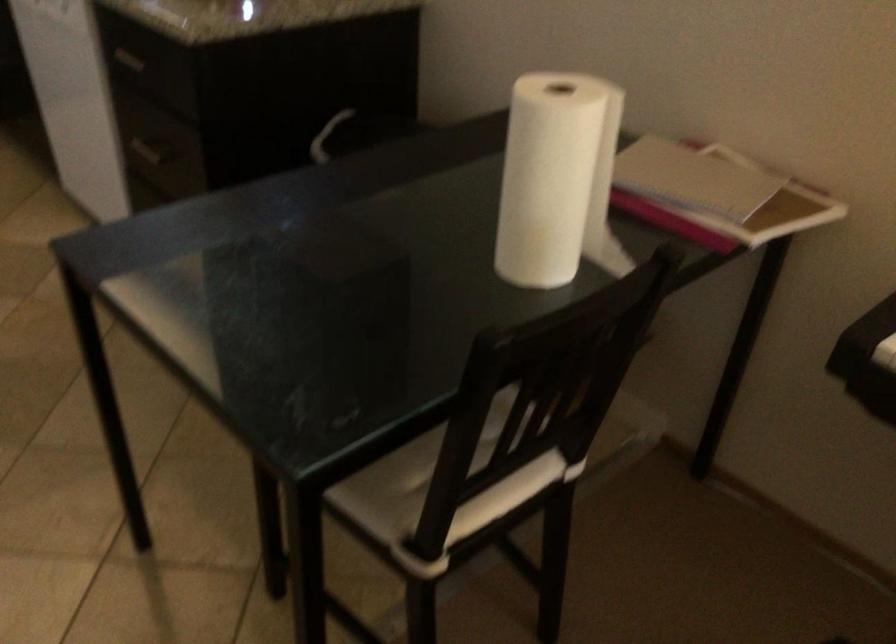
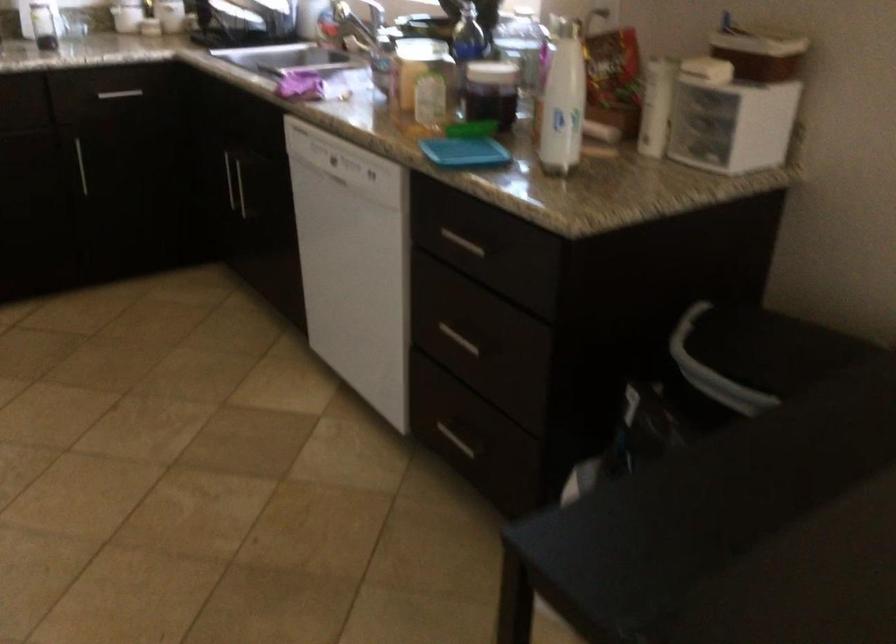
The images are taken continuously from a first-person perspective. In which direction are you moving?

The cameraman moved toward left, forward.